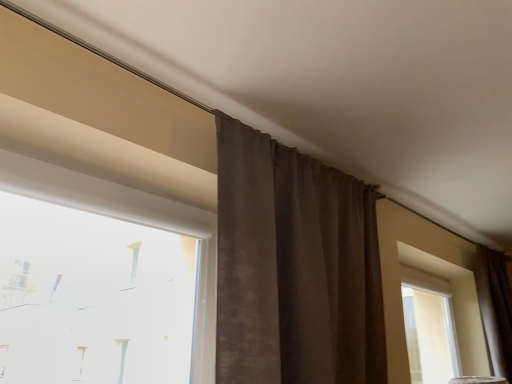
Question: Would you say brown textured curtain at center, which is counted as the 2th curtain, starting from the right, is inside or outside white plastic window at upper left?

Choices:
 (A) inside
 (B) outside

Answer: (B)

Question: In terms of height, does brown textured curtain at center, which is counted as the 2th curtain, starting from the right, look taller or shorter compared to white plastic window at upper left?

Choices:
 (A) tall
 (B) short

Answer: (A)

Question: Which of these objects is positioned closest to the brown textured curtain at right, which ranks as the 1th curtain in right-to-left order?

Choices:
 (A) brown textured curtain at center, the first curtain when ordered from left to right
 (B) white plastic window at upper left

Answer: (A)

Question: Estimate the real-world distances between objects in this image. Which object is farther from the brown textured curtain at right, which is the 2th curtain in front-to-back order?

Choices:
 (A) white plastic window at upper left
 (B) brown textured curtain at center, the first curtain when ordered from left to right

Answer: (A)